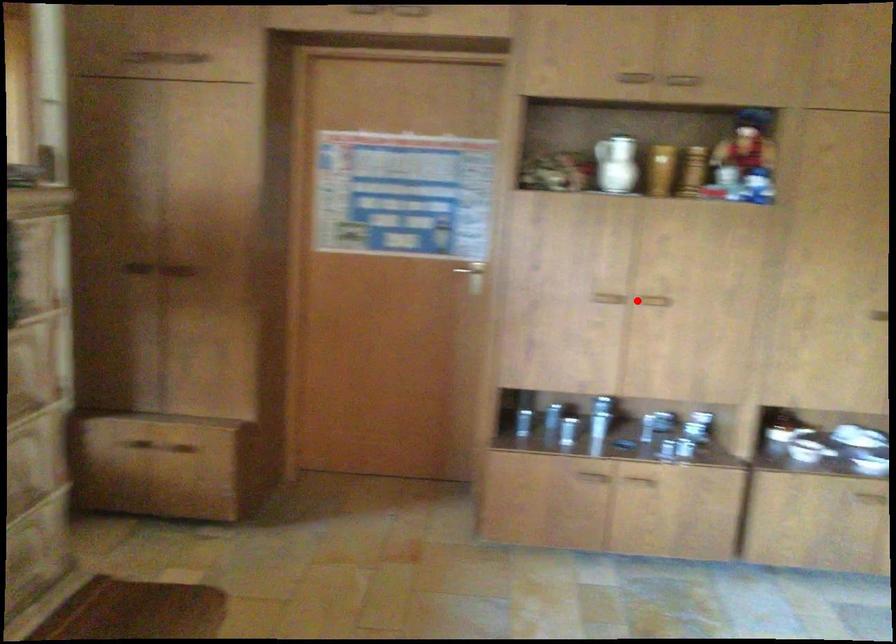
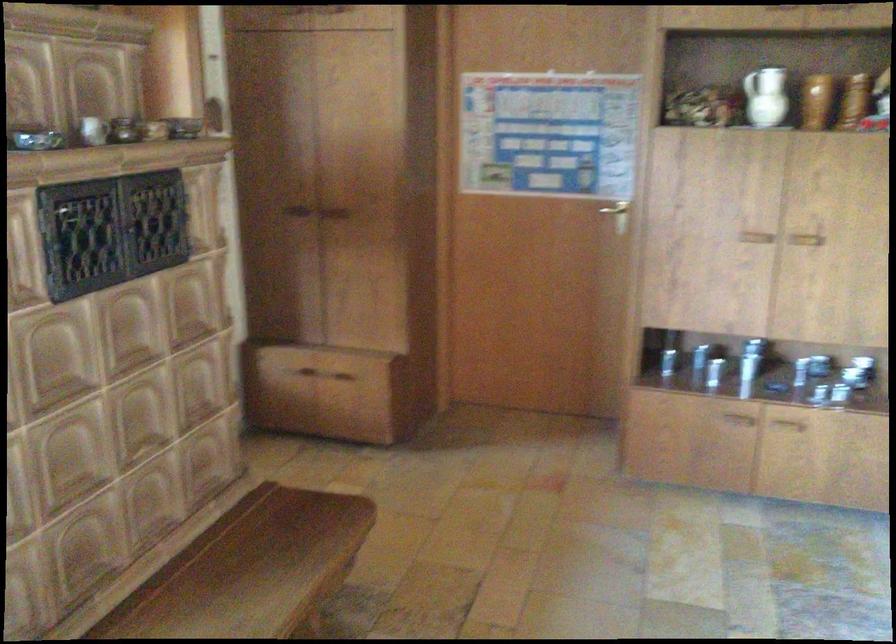
The point at the highlighted location is marked in the first image. Where is the corresponding point in the second image?

(785, 238)